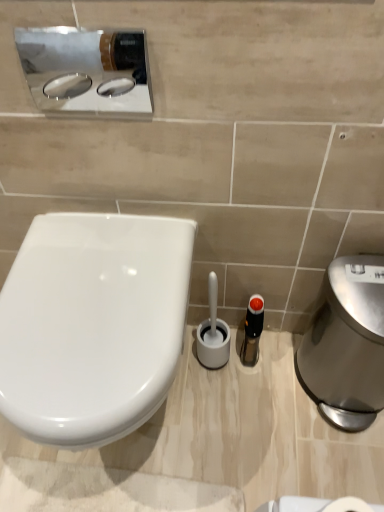
Question: Is the position of polished stainless steel hand dryer at right more distant than that of polished chrome sink at upper left?

Choices:
 (A) yes
 (B) no

Answer: (A)

Question: From the image's perspective, is polished stainless steel hand dryer at right above polished chrome sink at upper left?

Choices:
 (A) no
 (B) yes

Answer: (A)

Question: Does polished stainless steel hand dryer at right turn towards polished chrome sink at upper left?

Choices:
 (A) yes
 (B) no

Answer: (B)

Question: Is polished stainless steel hand dryer at right shorter than polished chrome sink at upper left?

Choices:
 (A) yes
 (B) no

Answer: (B)

Question: From a real-world perspective, is polished stainless steel hand dryer at right physically below polished chrome sink at upper left?

Choices:
 (A) yes
 (B) no

Answer: (A)

Question: From a real-world perspective, is white glossy toilet at left positioned above or below translucent plastic bottle at center?

Choices:
 (A) above
 (B) below

Answer: (A)

Question: From the image's perspective, is white glossy toilet at left positioned above or below translucent plastic bottle at center?

Choices:
 (A) below
 (B) above

Answer: (B)

Question: Is white glossy toilet at left inside the boundaries of translucent plastic bottle at center, or outside?

Choices:
 (A) inside
 (B) outside

Answer: (B)

Question: Is point (81, 317) closer or farther from the camera than point (241, 357)?

Choices:
 (A) closer
 (B) farther

Answer: (A)

Question: Would you say polished stainless steel hand dryer at right is to the left or to the right of white glossy toilet at left in the picture?

Choices:
 (A) right
 (B) left

Answer: (A)

Question: From the image's perspective, relative to white glossy toilet at left, is polished stainless steel hand dryer at right above or below?

Choices:
 (A) above
 (B) below

Answer: (B)

Question: Is polished stainless steel hand dryer at right inside the boundaries of white glossy toilet at left, or outside?

Choices:
 (A) inside
 (B) outside

Answer: (B)

Question: Is polished stainless steel hand dryer at right taller or shorter than white glossy toilet at left?

Choices:
 (A) tall
 (B) short

Answer: (A)

Question: Is point 119,38 positioned closer to the camera than point 119,275?

Choices:
 (A) closer
 (B) farther

Answer: (A)

Question: In the image, is polished chrome sink at upper left positioned in front of or behind white glossy toilet at left?

Choices:
 (A) front
 (B) behind

Answer: (B)